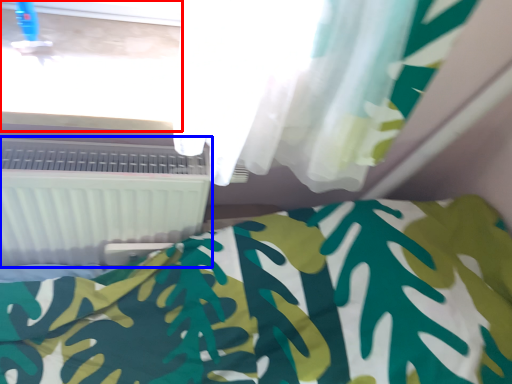
Question: Which object appears closest to the camera in this image, window frame (highlighted by a red box) or air conditioning (highlighted by a blue box)?

Choices:
 (A) window frame
 (B) air conditioning

Answer: (A)